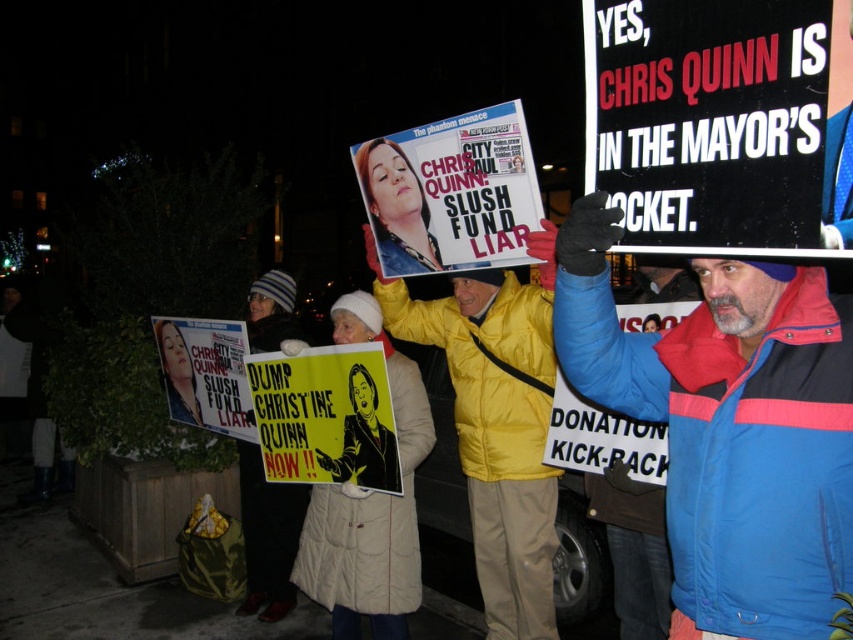
Between yellow puffy jacket at center and yellow paper poster at center, which one is positioned higher?

yellow paper poster at center is higher up.

Is yellow puffy jacket at center smaller than yellow paper poster at center?

Incorrect, yellow puffy jacket at center is not smaller in size than yellow paper poster at center.

The height and width of the screenshot is (640, 853). I want to click on yellow puffy jacket at center, so click(496, 422).

Which is above, matte newspaper at center or matte paper poster at lower left?

Positioned higher is matte newspaper at center.

Consider the image. Can you confirm if matte newspaper at center is bigger than matte paper poster at lower left?

No, matte newspaper at center is not bigger than matte paper poster at lower left.

Locate an element on the screen. The image size is (853, 640). matte newspaper at center is located at coordinates (451, 193).

Does yellow puffy jacket at center have a greater width compared to matte black poster at center?

Indeed, yellow puffy jacket at center has a greater width compared to matte black poster at center.

Describe the element at coordinates (496, 422) in the screenshot. I see `yellow puffy jacket at center` at that location.

The image size is (853, 640). Identify the location of yellow puffy jacket at center. (496, 422).